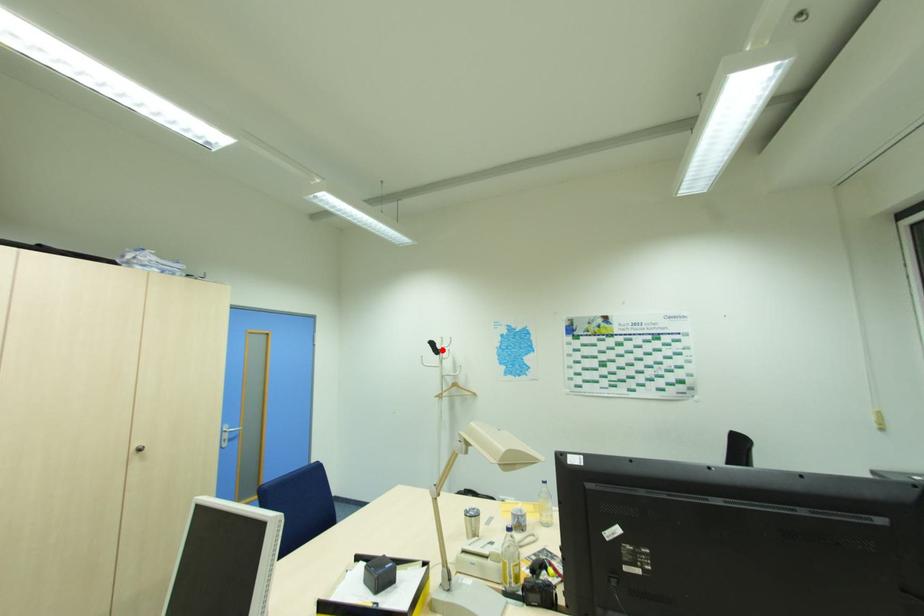
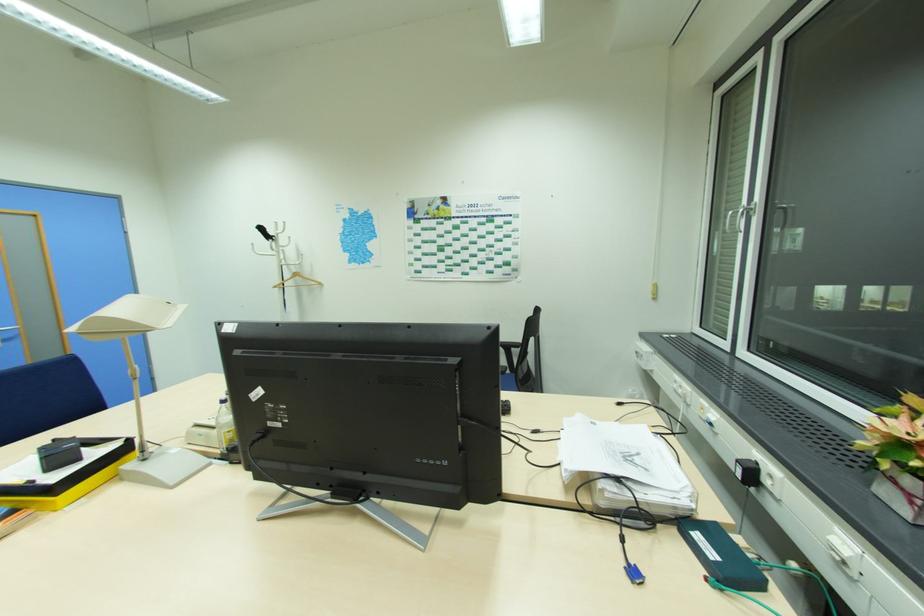
Question: A red point is marked in image1. In image2, is the corresponding 3D point closer to the camera or farther? Reply with the corresponding letter.

Choices:
 (A) The corresponding 3D point is closer.
 (B) The corresponding 3D point is farther.

Answer: (A)